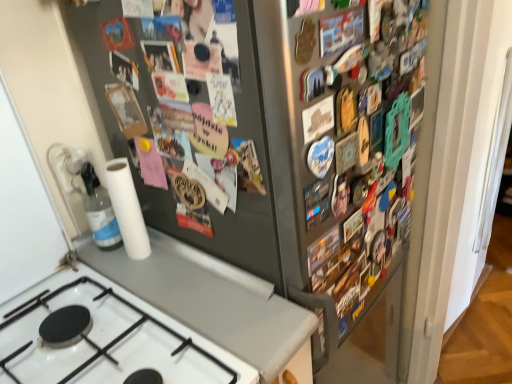
Where is `free space above white matte countertop at center (from a real-world perspective)`? This screenshot has width=512, height=384. free space above white matte countertop at center (from a real-world perspective) is located at coordinates tap(191, 284).